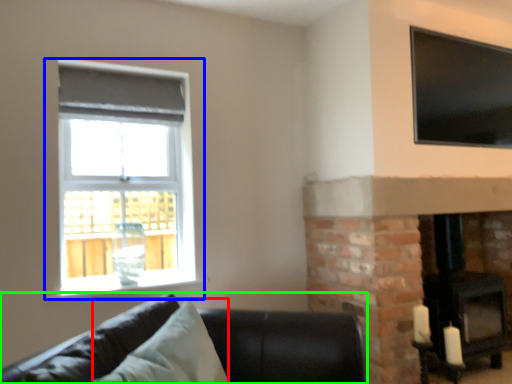
Question: Which is nearer to the pillow (highlighted by a red box)? window (highlighted by a blue box) or studio couch (highlighted by a green box).

Choices:
 (A) window
 (B) studio couch

Answer: (B)